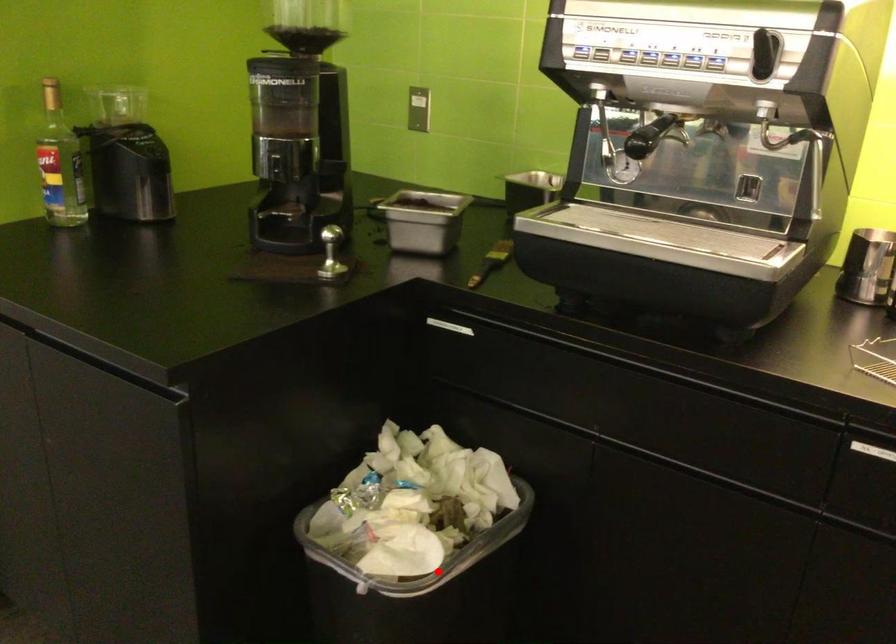
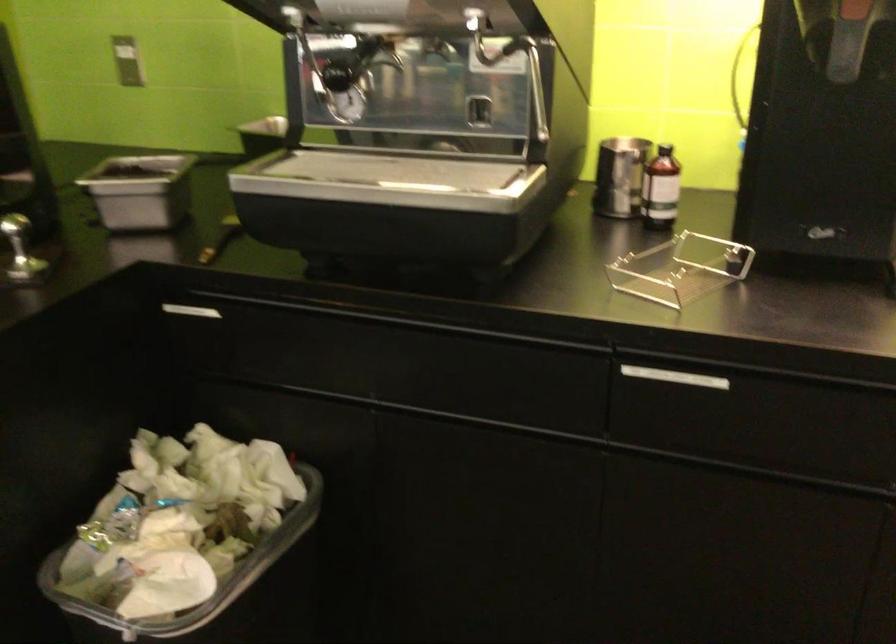
Locate, in the second image, the point that corresponds to the highlighted location in the first image.

(218, 592)